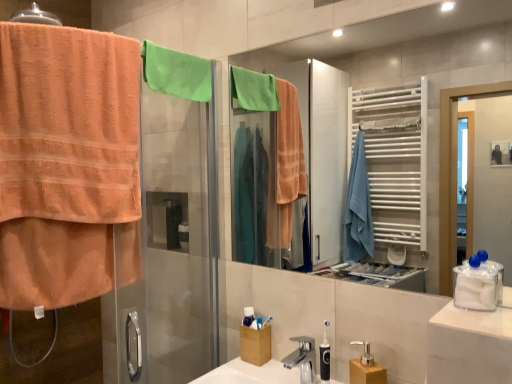
Question: Considering the positions of point (128, 46) and point (260, 317), is point (128, 46) closer or farther from the camera than point (260, 317)?

Choices:
 (A) farther
 (B) closer

Answer: (B)

Question: Considering the positions of orange terry cloth towel at left and white plastic toothbrush at center, positioned as the 1th toiletry in back-to-front order, in the image, is orange terry cloth towel at left taller or shorter than white plastic toothbrush at center, positioned as the 1th toiletry in back-to-front order,?

Choices:
 (A) tall
 (B) short

Answer: (A)

Question: Which is farther from the matte glass mirror at center?

Choices:
 (A) orange terry cloth towel at left
 (B) white plastic toothbrush at center, positioned as the 1th toiletry in back-to-front order
 (C) green cotton towel at upper center
 (D) black plastic toothbrush at center, marked as the 2th toiletry in a left-to-right arrangement

Answer: (B)

Question: Which object is the closest to the white plastic toothbrush at center, arranged as the first toiletry when viewed from the left?

Choices:
 (A) green cotton towel at upper center
 (B) black plastic toothbrush at center, the first toiletry from the right
 (C) orange terry cloth towel at left
 (D) matte glass mirror at center

Answer: (B)